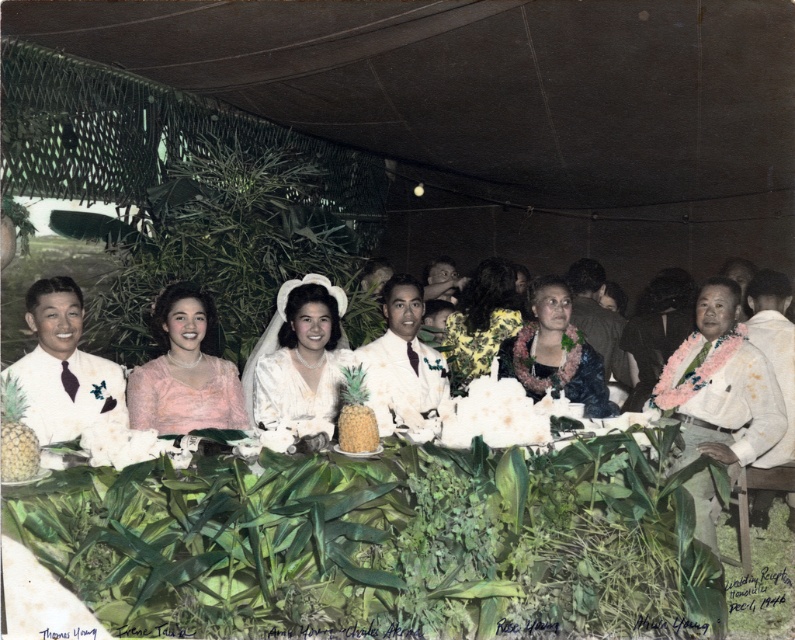
Who is more distant from viewer, (506, 410) or (348, 413)?

Point (506, 410)

Describe the element at coordinates (493, 413) in the screenshot. I see `white fluffy flower at center` at that location.

Is point (514, 419) positioned in front of point (351, 381)?

No, it is behind (351, 381).

You are a GUI agent. You are given a task and a screenshot of the screen. Output one action in this format:
    pyautogui.click(x=<x>, y=<y>)
    Task: Click on the white fluffy flower at center
    Image resolution: width=795 pixels, height=640 pixels.
    Given the screenshot: What is the action you would take?
    pyautogui.click(x=493, y=413)

Measure the distance from floral-patterned dress at center to yellow matte pineapple at center.

They are 1.91 meters apart.

Does floral-patterned dress at center have a greater width compared to yellow matte pineapple at center?

Indeed, floral-patterned dress at center has a greater width compared to yellow matte pineapple at center.

I want to click on floral-patterned dress at center, so click(481, 321).

Is black satin dress at center smaller than white fabric flower at center?

No.

Does black satin dress at center have a greater width compared to white fabric flower at center?

Yes, black satin dress at center is wider than white fabric flower at center.

This screenshot has width=795, height=640. In order to click on black satin dress at center in this screenshot , I will do pos(553,352).

Where is `black satin dress at center`? This screenshot has height=640, width=795. black satin dress at center is located at coordinates (553, 352).